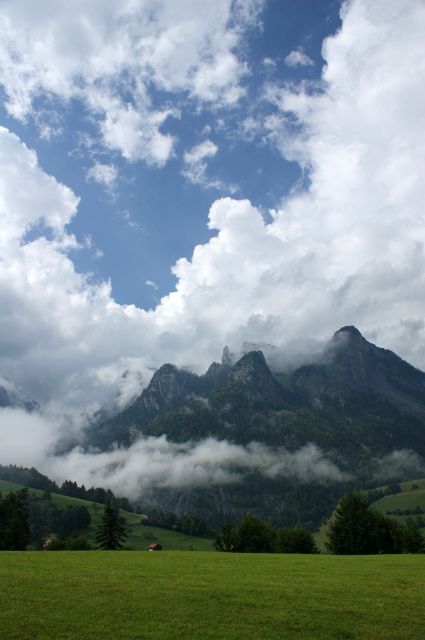
Question: Can you confirm if white fluffy cloud at upper center is positioned to the right of green grassy field at lower center?

Choices:
 (A) no
 (B) yes

Answer: (A)

Question: Among these objects, which one is nearest to the camera?

Choices:
 (A) green grassy field at lower center
 (B) white fluffy cloud at upper center

Answer: (A)

Question: Does white fluffy cloud at upper center have a smaller size compared to green grassy field at lower center?

Choices:
 (A) no
 (B) yes

Answer: (A)

Question: Which object is farther from the camera taking this photo?

Choices:
 (A) white fluffy cloud at upper center
 (B) green grassy field at lower center

Answer: (A)

Question: Does white fluffy cloud at upper center appear on the left side of green grassy field at lower center?

Choices:
 (A) yes
 (B) no

Answer: (A)

Question: Which object appears closest to the camera in this image?

Choices:
 (A) green grassy field at lower center
 (B) white fluffy cloud at upper center

Answer: (A)